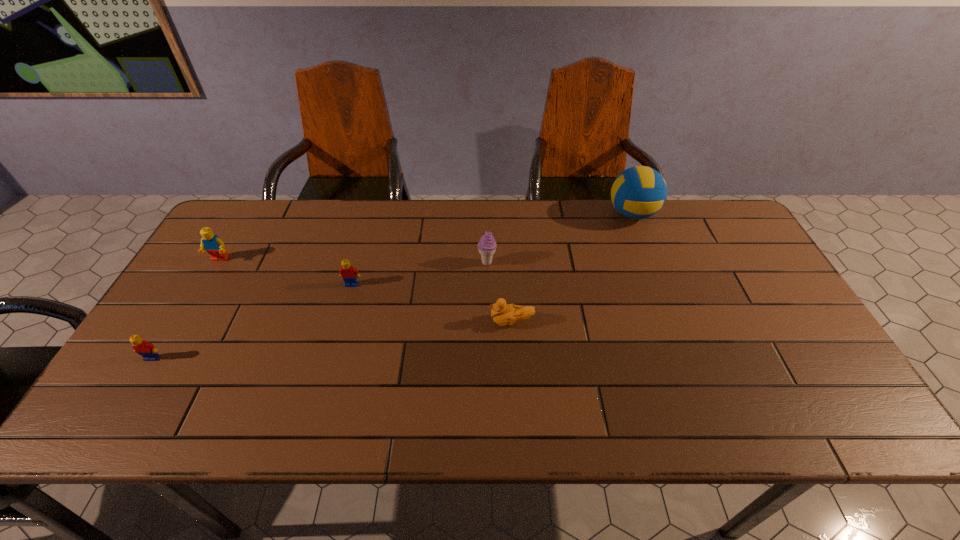
Where is `vacant area situated on the front-facing side of the farthest Lego`? vacant area situated on the front-facing side of the farthest Lego is located at coordinates (208, 279).

Locate an element on the screen. The width and height of the screenshot is (960, 540). vacant space located on the face of the second farthest Lego is located at coordinates (322, 394).

Find the location of a particular element. The height and width of the screenshot is (540, 960). free space located 0.280m on the face of the fifth farthest object is located at coordinates (382, 322).

I want to click on vacant space located on the face of the fifth farthest object, so click(x=367, y=322).

Find the location of `vacant space located on the face of the fifth farthest object`. vacant space located on the face of the fifth farthest object is located at coordinates (367, 322).

Find the location of a particular element. free spot located on the face of the nearest object is located at coordinates pos(114,420).

In order to click on object situated at the far edge in this screenshot , I will do `click(639, 192)`.

Locate an element on the screen. The image size is (960, 540). free region at the far edge is located at coordinates (603, 236).

Find the location of a particular element. This screenshot has height=540, width=960. vacant space at the near edge of the desktop is located at coordinates (227, 426).

Find the location of a particular element. Image resolution: width=960 pixels, height=540 pixels. free location at the left edge of the desktop is located at coordinates (236, 268).